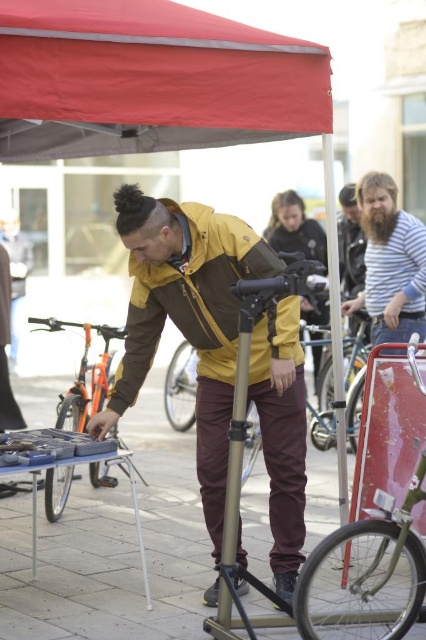
You are standing in the outdoor scene and want to hand a tool to both the person in the brown matte jacket at center and the person in the striped fabric shirt at upper right. Which person should you approach first to ensure you can reach them without moving too far from your current position?

You should approach the brown matte jacket at center first because it is closer to the viewer than the striped fabric shirt at upper right, so you can reach them without moving as much.

You are standing in the outdoor area where the man is working. There is a red fabric canopy at upper center and a matte yellow jacket at center. Which object is wider?

The red fabric canopy at upper center is wider than the matte yellow jacket at center.